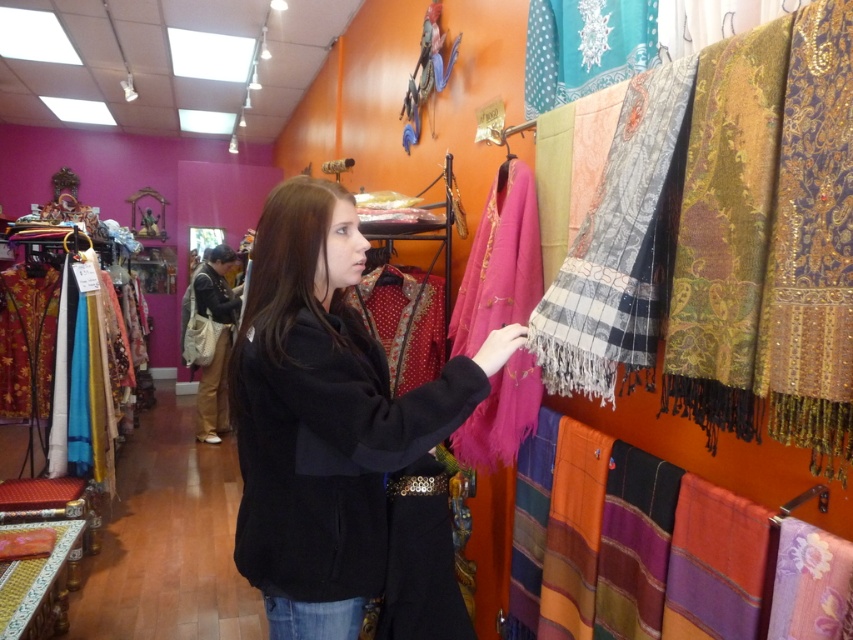
You are a customer in the clothing store and want to try on the black woolen coat at center and the multicolored woven scarf at right. Since you can only carry one item at a time, which item should you pick up first if you want to reach the fitting room located to the left of the entrance?

You should pick up the black woolen coat at center first because it is located to the left of the multicolored woven scarf at right, so it is closer to the fitting room on the left side of the entrance.

You are standing in the clothing store and want to take a photo of both the point at coordinates point (289, 472) and point (563, 627). Which point should you focus on first to ensure both are in clear view?

You should focus on point (289, 472) first since it is closer to the camera than point (563, 627). This will help ensure both points are in focus as the depth of field may capture the farther point as well.

You are a store employee organizing the racks. You need to hang the black woolen coat at center and the multicolored woven scarf at right on the same rack. Which item should you place higher up to ensure both are visible?

The black woolen coat at center is taller than the multicolored woven scarf at right, so you should place the multicolored woven scarf at right higher up on the rack to ensure both items are visible.